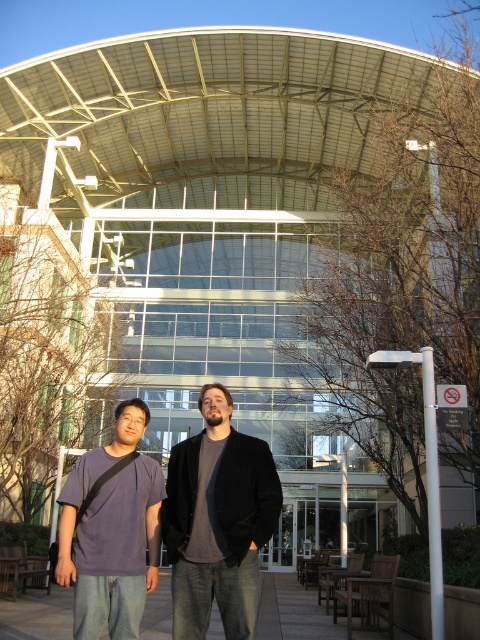
Is dark gray fleece jacket at center shorter than matte purple t-shirt at center?

No.

Who is higher up, dark gray fleece jacket at center or matte purple t-shirt at center?

dark gray fleece jacket at center is higher up.

Locate an element on the screen. The width and height of the screenshot is (480, 640). dark gray fleece jacket at center is located at coordinates (217, 522).

This screenshot has height=640, width=480. What are the coordinates of `dark gray fleece jacket at center` in the screenshot? It's located at (217, 522).

Can you confirm if matte purple t-shirt at center is smaller than smooth concrete pavement at center?

Yes.

Is matte purple t-shirt at center positioned in front of smooth concrete pavement at center?

Yes, it is in front of smooth concrete pavement at center.

Is point (158, 490) more distant than point (62, 588)?

No, (158, 490) is closer to viewer.

Identify the location of matte purple t-shirt at center. The height and width of the screenshot is (640, 480). (111, 531).

Which is in front, point (204, 429) or point (331, 620)?

Point (204, 429) is more forward.

Can you confirm if dark gray fleece jacket at center is positioned to the left of smooth concrete pavement at center?

No, dark gray fleece jacket at center is not to the left of smooth concrete pavement at center.

Which is in front, point (235, 609) or point (56, 620)?

Point (235, 609) is more forward.

Locate an element on the screen. dark gray fleece jacket at center is located at coordinates (217, 522).